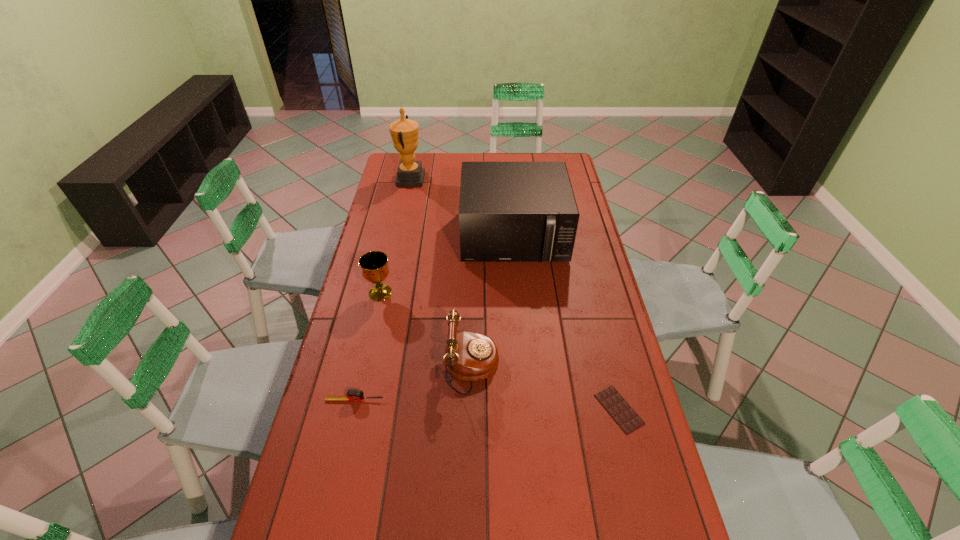
You are a GUI agent. You are given a task and a screenshot of the screen. Output one action in this format:
    pyautogui.click(x=<x>, y=<y>)
    Task: Click on the award
    
    Given the screenshot: What is the action you would take?
    pyautogui.click(x=404, y=132)

In order to click on the tallest object in this screenshot , I will do `click(404, 132)`.

At what (x,y) coordinates should I click in order to perform the action: click on microwave oven. Please return your answer as a coordinate pair (x, y). Image resolution: width=960 pixels, height=540 pixels. Looking at the image, I should click on (508, 211).

Where is `the second farthest object`? the second farthest object is located at coordinates (508, 211).

Where is `chalice`? The width and height of the screenshot is (960, 540). chalice is located at coordinates (374, 264).

The image size is (960, 540). I want to click on telephone, so click(469, 356).

I want to click on the second shortest object, so click(x=353, y=395).

Where is `the shortest object`? the shortest object is located at coordinates point(623,414).

Identify the location of vacant region located at the front of the farthest object with handles. This screenshot has width=960, height=540. (446, 179).

Find the location of a particular element. The height and width of the screenshot is (540, 960). free space located 0.090m on the front-facing side of the fifth nearest object is located at coordinates (517, 286).